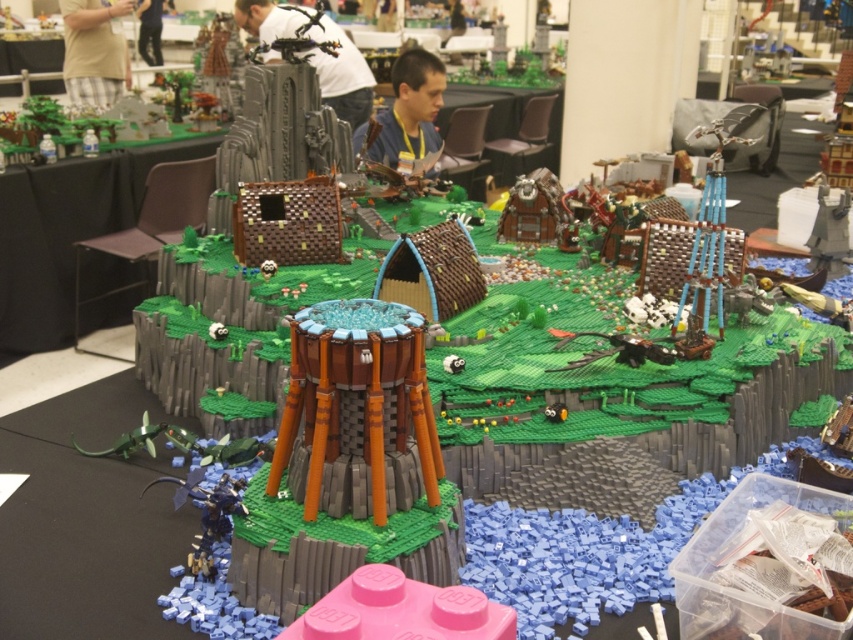
Is brown textured tower at center shorter than green grassy hill at upper left?

Yes, brown textured tower at center is shorter than green grassy hill at upper left.

Is brown textured tower at center further to camera compared to green grassy hill at upper left?

No, it is in front of green grassy hill at upper left.

Identify the location of brown textured tower at center. The image size is (853, 640). (349, 461).